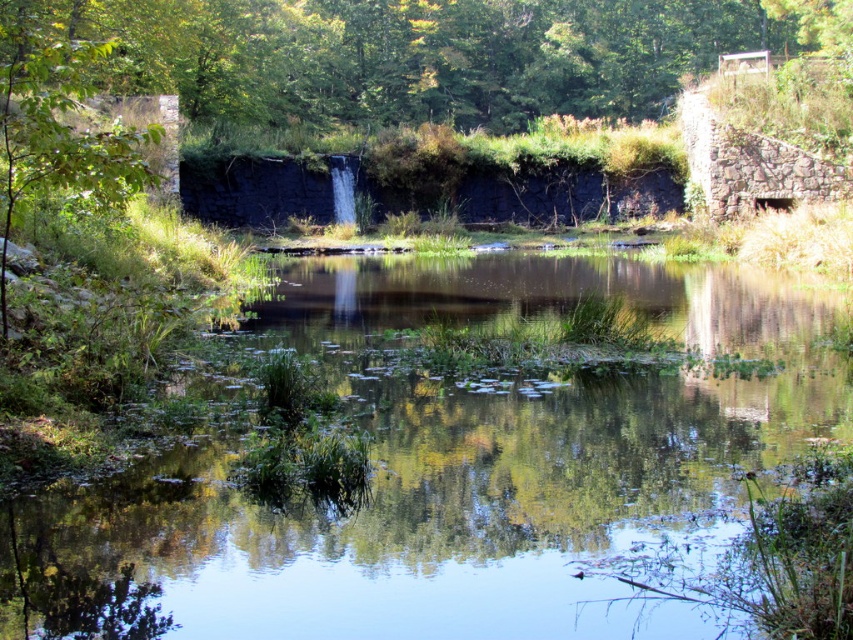
You are standing at the edge of the pond in the serene natural scene. You notice a point marked at coordinates [421,52]. What object is located at that point?

The point at coordinates [421,52] indicates a green leafy tree at upper center.